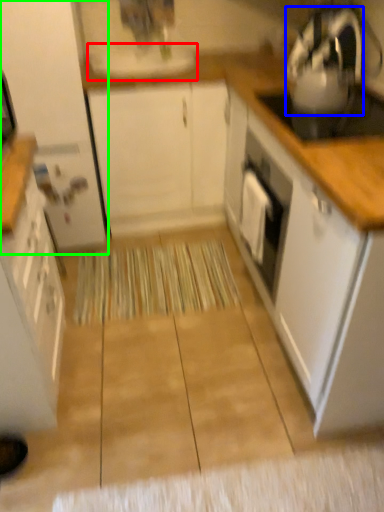
Question: Estimate the real-world distances between objects in this image. Which object is farther from sink (highlighted by a red box), kitchen appliance (highlighted by a blue box) or cabinetry (highlighted by a green box)?

Choices:
 (A) kitchen appliance
 (B) cabinetry

Answer: (A)